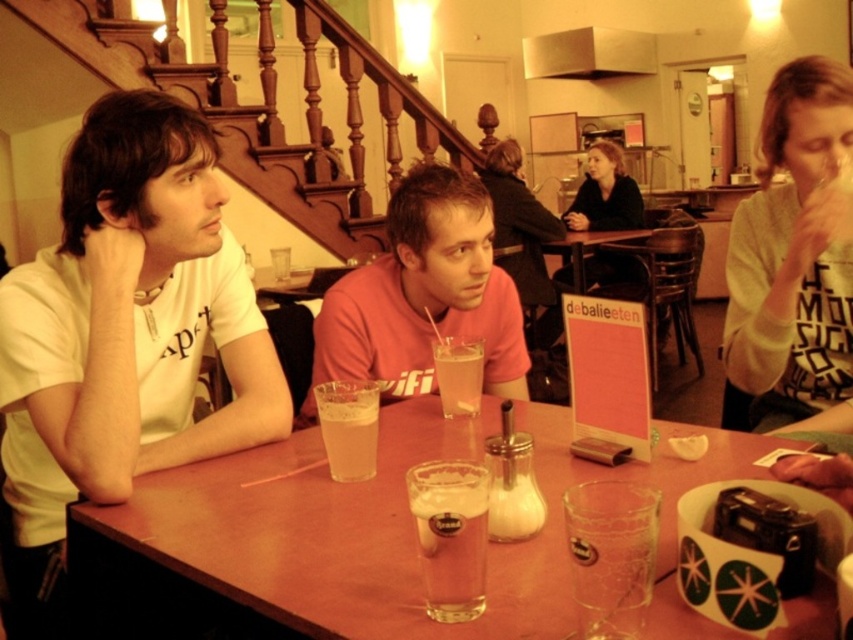
In the scene, there is a white matte t shirt at left and a red T shirt with ifi printed on it. Which T shirt is closer to the point marked at (x=125, y=332)?

The white matte t shirt at left is located at point (x=125, y=332), so it is exactly at that coordinate. The red T shirt with ifi printed on it is further away from that point.